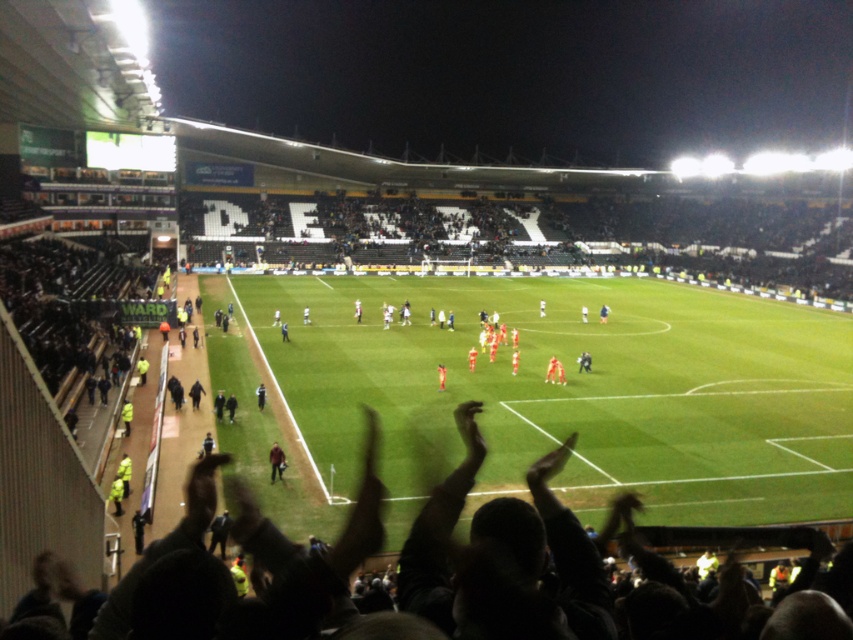
Which is in front, point (271, 476) or point (440, 364)?

Point (271, 476) is more forward.

The height and width of the screenshot is (640, 853). What are the coordinates of `brown leather jacket at center` in the screenshot? It's located at (276, 461).

Who is lower down, green grass football field at center or orange jersey at center?

orange jersey at center

Measure the distance between green grass football field at center and camera.

They are 18.81 meters apart.

Where is `green grass football field at center`? The image size is (853, 640). green grass football field at center is located at coordinates (579, 392).

In the scene shown: Does green grass football field at center appear on the left side of brown leather jacket at center?

In fact, green grass football field at center is to the right of brown leather jacket at center.

Which is in front, point (782, 332) or point (276, 472)?

Point (276, 472) is in front.

Describe the element at coordinates (579, 392) in the screenshot. The height and width of the screenshot is (640, 853). I see `green grass football field at center` at that location.

This screenshot has height=640, width=853. I want to click on green grass football field at center, so click(579, 392).